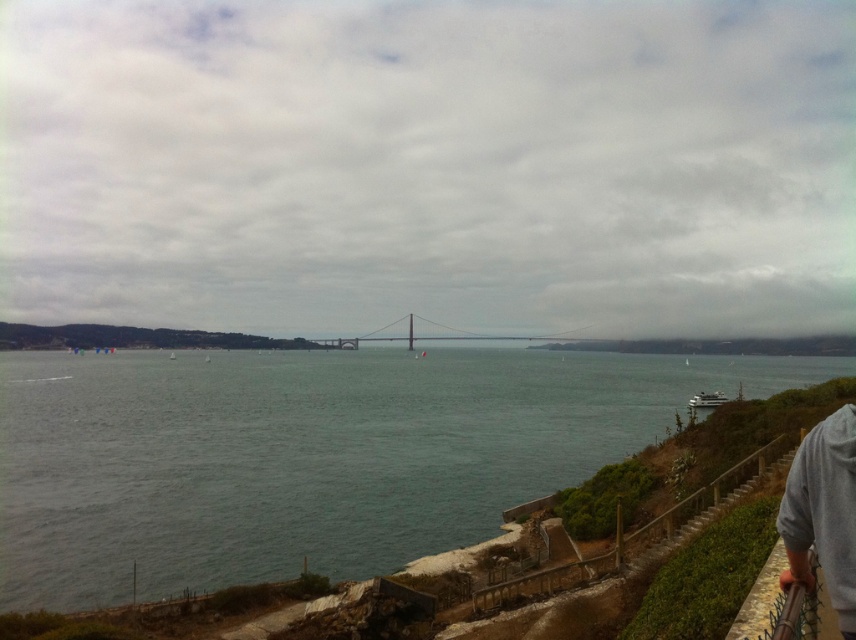
Is greenish water at center to the right of metallic gray bridge at center from the viewer's perspective?

Incorrect, greenish water at center is not on the right side of metallic gray bridge at center.

What do you see at coordinates (308, 456) in the screenshot?
I see `greenish water at center` at bounding box center [308, 456].

Which is behind, point (15, 545) or point (557, 337)?

Point (557, 337)

Where is `greenish water at center`? This screenshot has width=856, height=640. greenish water at center is located at coordinates (308, 456).

Can you confirm if gray hoodie at lower right is positioned above metallic gray bridge at center?

Incorrect, gray hoodie at lower right is not positioned above metallic gray bridge at center.

Where is `gray hoodie at lower right`? This screenshot has width=856, height=640. gray hoodie at lower right is located at coordinates (823, 513).

Which is below, greenish water at center or gray hoodie at lower right?

greenish water at center

Does point (199, 515) lie in front of point (811, 500)?

No, (199, 515) is further to viewer.

Which is in front, point (266, 486) or point (829, 493)?

Positioned in front is point (829, 493).

At what (x,y) coordinates should I click in order to perform the action: click on greenish water at center. Please return your answer as a coordinate pair (x, y). Looking at the image, I should click on (308, 456).